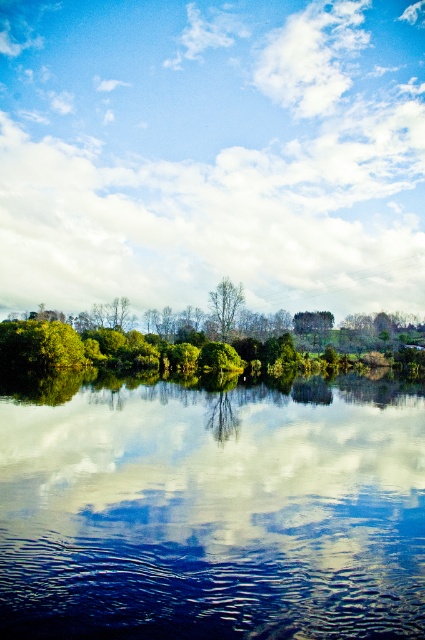
Question: Estimate the real-world distances between objects in this image. Which object is farther from the green leafy tree at center?

Choices:
 (A) white fluffy cloud at upper center
 (B) smooth glass water at center

Answer: (A)

Question: Which object is closer to the camera taking this photo?

Choices:
 (A) white fluffy cloud at upper center
 (B) smooth glass water at center

Answer: (B)

Question: Is green leafy tree at center bigger than green matte tree at center?

Choices:
 (A) no
 (B) yes

Answer: (B)

Question: Which object is the closest to the green leafy tree at center?

Choices:
 (A) green matte tree at center
 (B) white fluffy cloud at upper center

Answer: (A)

Question: Does white fluffy cloud at upper center have a lesser width compared to transparent glass water at center?

Choices:
 (A) yes
 (B) no

Answer: (B)

Question: Can you confirm if white fluffy cloud at upper center is bigger than transparent glass water at center?

Choices:
 (A) yes
 (B) no

Answer: (A)